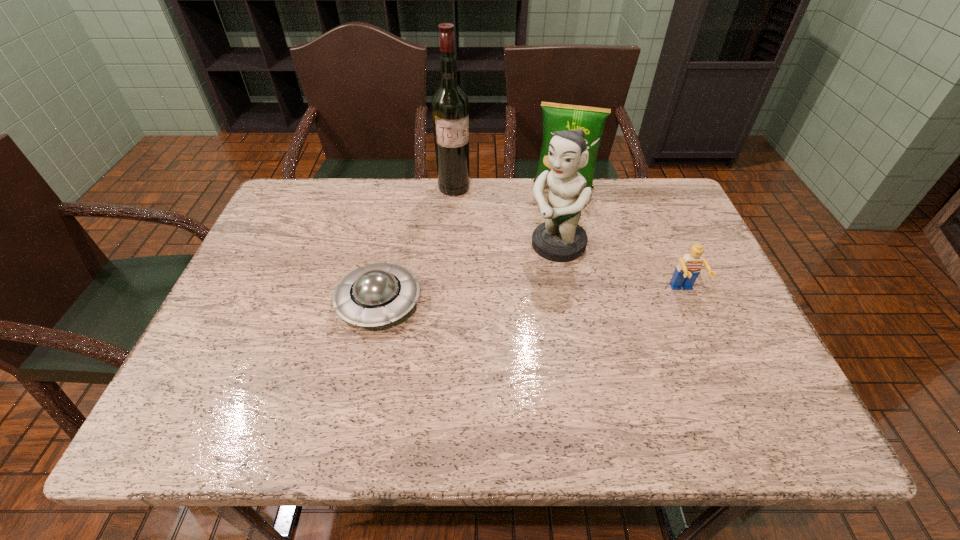
You are a GUI agent. You are given a task and a screenshot of the screen. Output one action in this format:
    pyautogui.click(x=<x>, y=<y>)
    Task: Click on the free space between the wine bottle and the third shortest object
    
    Given the screenshot: What is the action you would take?
    pyautogui.click(x=509, y=187)

Find the location of a particular element. This screenshot has width=960, height=540. free point between the leftmost object and the Lego is located at coordinates (531, 297).

The height and width of the screenshot is (540, 960). What are the coordinates of `free space between the second tallest object and the fourth object from right to left` in the screenshot? It's located at (506, 217).

You are a GUI agent. You are given a task and a screenshot of the screen. Output one action in this format:
    pyautogui.click(x=<x>, y=<y>)
    Task: Click on the empty location between the third farthest object and the second shortest object
    The height and width of the screenshot is (540, 960).
    Given the screenshot: What is the action you would take?
    pyautogui.click(x=620, y=268)

Identify the location of free space between the fourth shortest object and the shortest object. (468, 274).

You are a GUI agent. You are given a task and a screenshot of the screen. Output one action in this format:
    pyautogui.click(x=<x>, y=<y>)
    Task: Click on the free space between the third nearest object and the shortest object
    This screenshot has width=960, height=540.
    Given the screenshot: What is the action you would take?
    pyautogui.click(x=468, y=274)

Where is `vacant space in between the second shortest object and the leftmost object`? The height and width of the screenshot is (540, 960). vacant space in between the second shortest object and the leftmost object is located at coordinates (531, 297).

This screenshot has height=540, width=960. Identify the location of vacant space that's between the shortest object and the crisp (potato chip). (471, 245).

You are a GUI agent. You are given a task and a screenshot of the screen. Output one action in this format:
    pyautogui.click(x=<x>, y=<y>)
    Task: Click on the vacant space that's between the tallest object and the figurine
    This screenshot has width=960, height=540.
    Given the screenshot: What is the action you would take?
    pyautogui.click(x=506, y=217)

In order to click on the closest object to the saucer in this screenshot , I will do `click(560, 238)`.